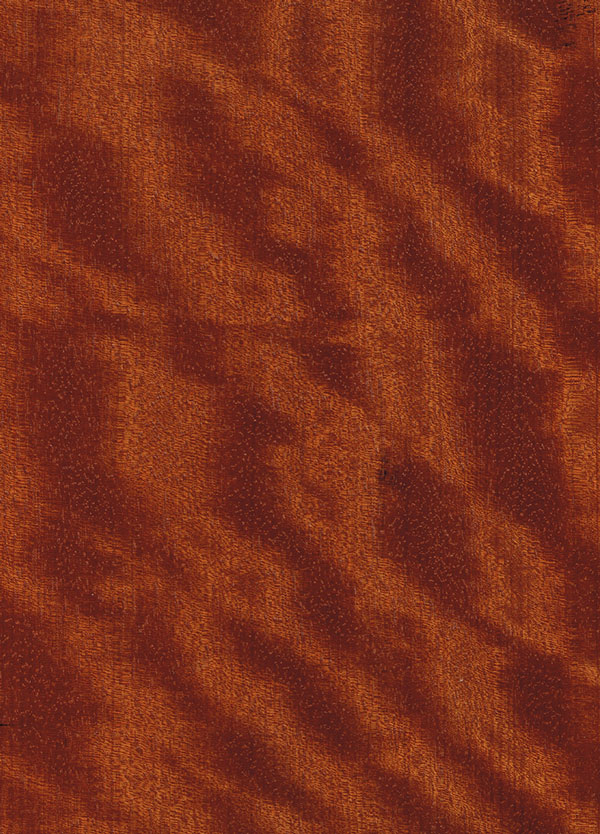
Where is `empty space bottom of blanket`? This screenshot has height=834, width=600. empty space bottom of blanket is located at coordinates (309, 781).